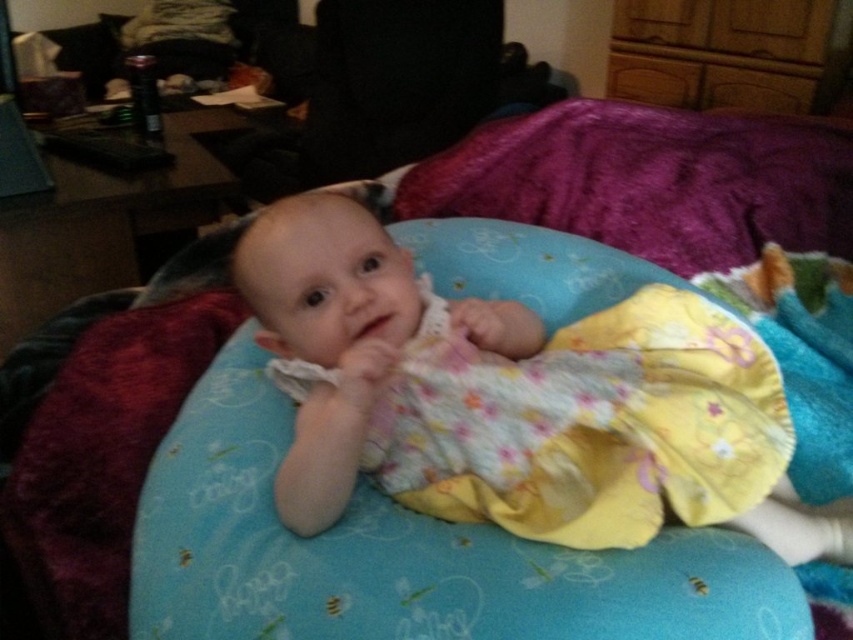
You are a photographer setting up for a baby photoshoot. You need to position a light source to the right of the yellow floral dress at center and to the left of the purple plush blanket at upper center. Is this possible based on their positions?

The yellow floral dress at center is to the left of the purple plush blanket at upper center, so placing the light source to the right of the yellow floral dress at center and to the left of the purple plush blanket at upper center is possible between them.

In the image, you see a baby lying on a blue cushion with a yellow floral dress at center and a purple plush blanket at upper center. Which object is taller?

The yellow floral dress at center is taller than the purple plush blanket at upper center.